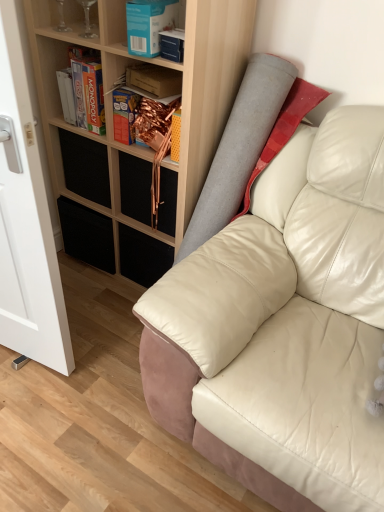
At what (x,y) coordinates should I click in order to perform the action: click on vacant area located to the right-hand side of white glossy glass door at left. Please return your answer as a coordinate pair (x, y). Looking at the image, I should click on [x=102, y=359].